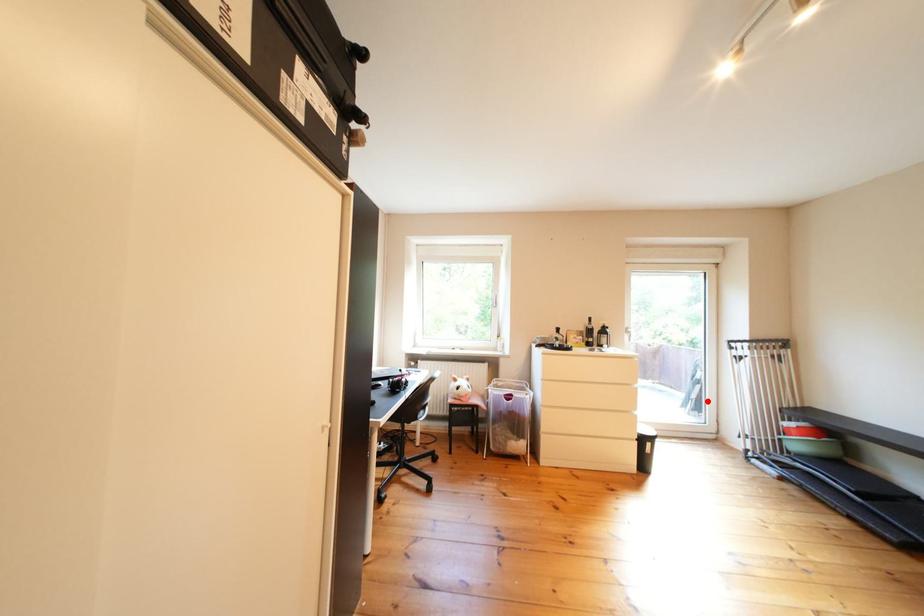
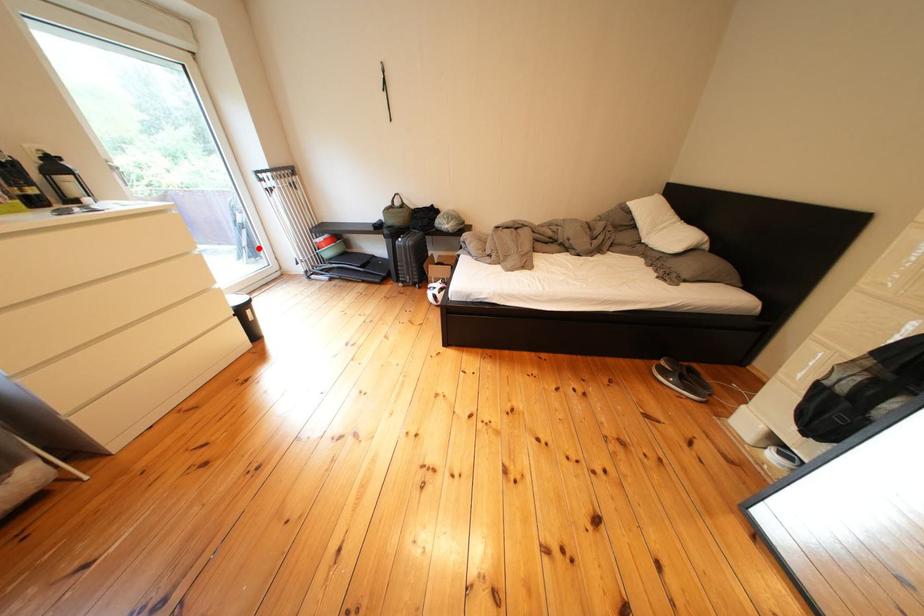
I am providing you with two images of the same scene from different viewpoints. A red point is marked on the first image and another point is marked on the second image. Do the highlighted points in image1 and image2 indicate the same real-world spot?

Yes